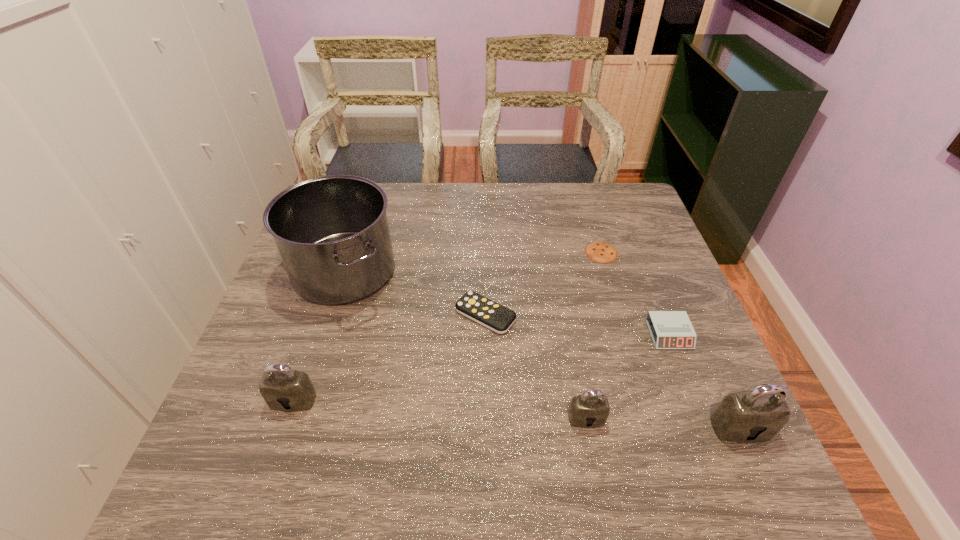
Please determine a free point for an extra padlock to ensure balance. Please provide its 2D coordinates. Your answer should be formatted as a tuple, i.e. [(x, y)], where the tuple contains the x and y coordinates of a point satisfying the conditions above.

[(438, 409)]